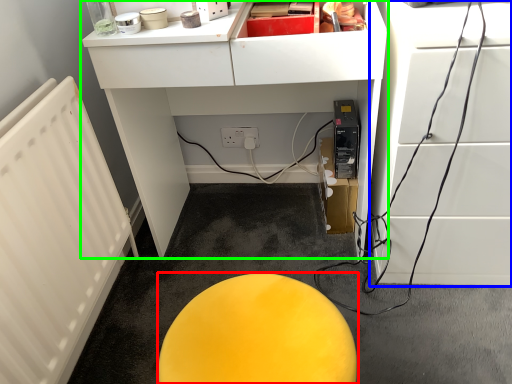
Question: Which is nearer to the furniture (highlighted by a red box)? furniture (highlighted by a blue box) or furniture (highlighted by a green box).

Choices:
 (A) furniture
 (B) furniture

Answer: (A)